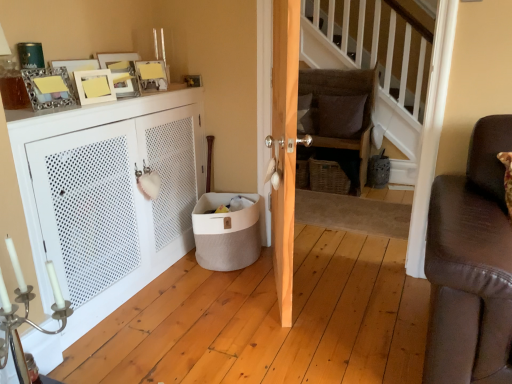
Question: From a real-world perspective, is matte gold picture frame at upper left, placed as the 2th picture frame when sorted from front to back, positioned under woven brown basket at center based on gravity?

Choices:
 (A) yes
 (B) no

Answer: (B)

Question: Considering the relative sizes of matte gold picture frame at upper left, the third picture frame viewed from the back, and woven brown basket at center in the image provided, is matte gold picture frame at upper left, the third picture frame viewed from the back, shorter than woven brown basket at center?

Choices:
 (A) yes
 (B) no

Answer: (A)

Question: Is matte gold picture frame at upper left, placed as the 2th picture frame when sorted from front to back, not inside woven brown basket at center?

Choices:
 (A) no
 (B) yes

Answer: (B)

Question: Is matte gold picture frame at upper left, placed as the 2th picture frame when sorted from front to back, bigger than woven brown basket at center?

Choices:
 (A) yes
 (B) no

Answer: (B)

Question: Is matte gold picture frame at upper left, placed as the 2th picture frame when sorted from front to back, positioned behind woven brown basket at center?

Choices:
 (A) no
 (B) yes

Answer: (A)

Question: Is point (143, 87) closer or farther from the camera than point (54, 306)?

Choices:
 (A) farther
 (B) closer

Answer: (A)

Question: From a real-world perspective, is metallic silver picture frame at upper left, the 2th picture frame positioned from the right, physically located above or below silver metallic candle holder at lower left?

Choices:
 (A) below
 (B) above

Answer: (B)

Question: Considering their positions, is metallic silver picture frame at upper left, which is counted as the third picture frame, starting from the front, located in front of or behind silver metallic candle holder at lower left?

Choices:
 (A) behind
 (B) front

Answer: (A)

Question: Is metallic silver picture frame at upper left, which is the third picture frame in left-to-right order, taller or shorter than silver metallic candle holder at lower left?

Choices:
 (A) short
 (B) tall

Answer: (A)

Question: Considering the positions of point (12, 114) and point (329, 185), is point (12, 114) closer or farther from the camera than point (329, 185)?

Choices:
 (A) farther
 (B) closer

Answer: (B)

Question: Is white matte cabinet at left taller or shorter than woven brown basket at center?

Choices:
 (A) short
 (B) tall

Answer: (B)

Question: In terms of size, does white matte cabinet at left appear bigger or smaller than woven brown basket at center?

Choices:
 (A) big
 (B) small

Answer: (A)

Question: Considering their positions, is white matte cabinet at left located in front of or behind woven brown basket at center?

Choices:
 (A) behind
 (B) front

Answer: (B)

Question: From the image's perspective, is brown fabric pillow at center, which appears as the first pillow when viewed from the right, positioned above or below matte gold picture frame at upper left, positioned as the 4th picture frame in right-to-left order?

Choices:
 (A) above
 (B) below

Answer: (A)

Question: Considering the positions of brown fabric pillow at center, marked as the 2th pillow in a left-to-right arrangement, and matte gold picture frame at upper left, acting as the 1th picture frame starting from the left, in the image, is brown fabric pillow at center, marked as the 2th pillow in a left-to-right arrangement, taller or shorter than matte gold picture frame at upper left, acting as the 1th picture frame starting from the left,?

Choices:
 (A) tall
 (B) short

Answer: (A)